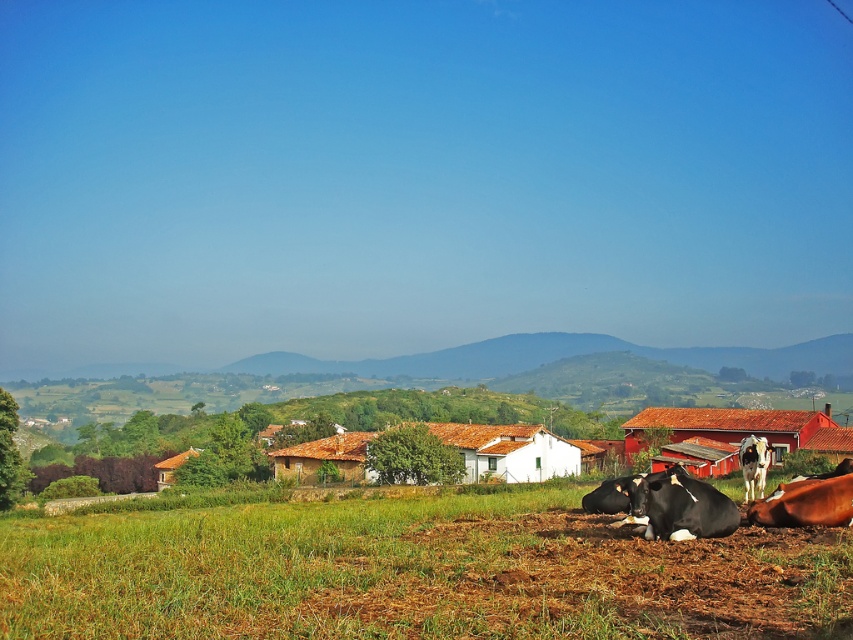
Question: Is green grass at lower left to the left of brown glossy cow at lower right from the viewer's perspective?

Choices:
 (A) no
 (B) yes

Answer: (B)

Question: Which of the following is the farthest from the observer?

Choices:
 (A) white glossy cow at lower right
 (B) black glossy cow at lower center

Answer: (A)

Question: Which point is farther to the camera?

Choices:
 (A) black glossy cow at lower center
 (B) white glossy cow at lower right
 (C) green grass at lower left

Answer: (B)

Question: Which is nearer to the black glossy cow at lower center?

Choices:
 (A) white glossy cow at lower right
 (B) brown glossy cow at lower right
 (C) green grass at lower left

Answer: (B)

Question: Can you confirm if brown glossy cow at lower right is positioned below white glossy cow at lower right?

Choices:
 (A) yes
 (B) no

Answer: (B)

Question: Is green grass at lower left in front of brown glossy cow at lower right?

Choices:
 (A) yes
 (B) no

Answer: (A)